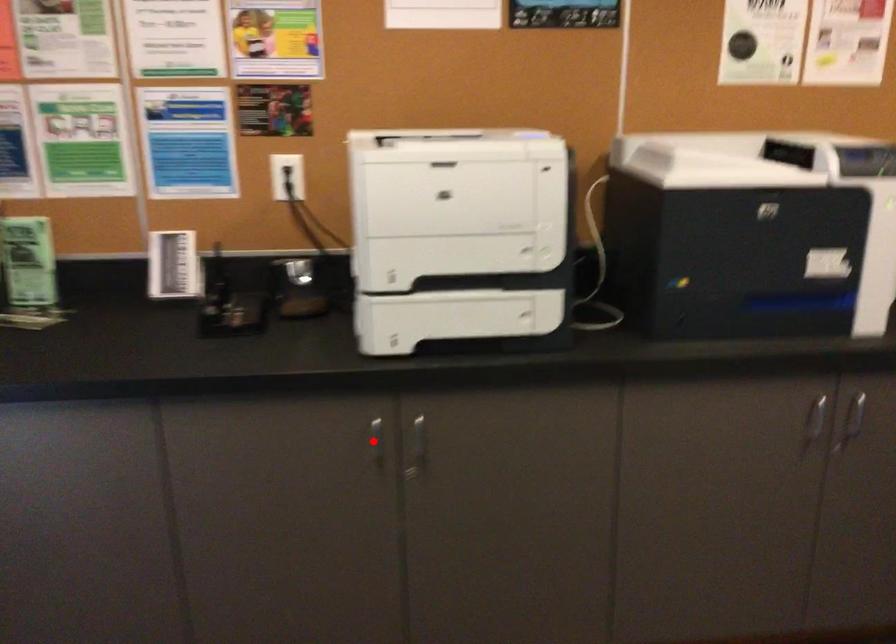
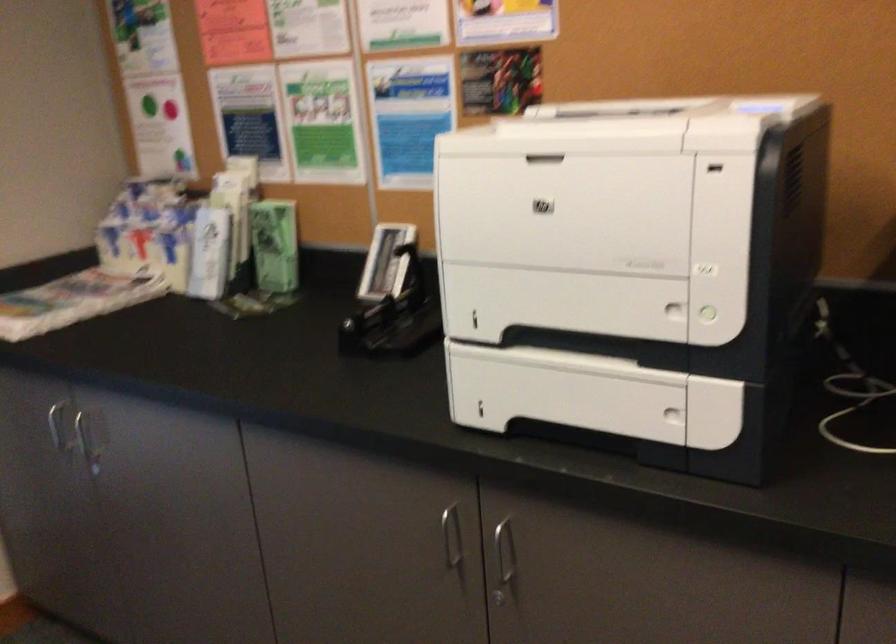
In the second image, find the point that corresponds to the highlighted location in the first image.

(452, 538)